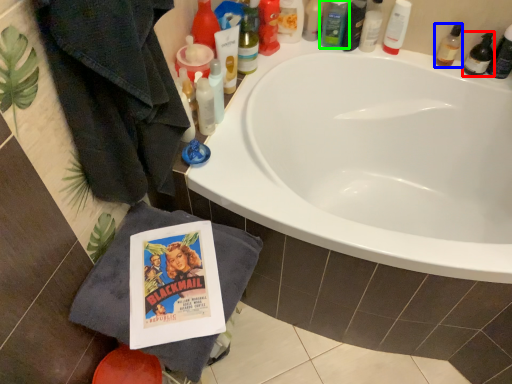
Question: Estimate the real-world distances between objects in this image. Which object is closer to mouthwash (highlighted by a red box), toiletry (highlighted by a blue box) or toiletry (highlighted by a green box)?

Choices:
 (A) toiletry
 (B) toiletry

Answer: (A)